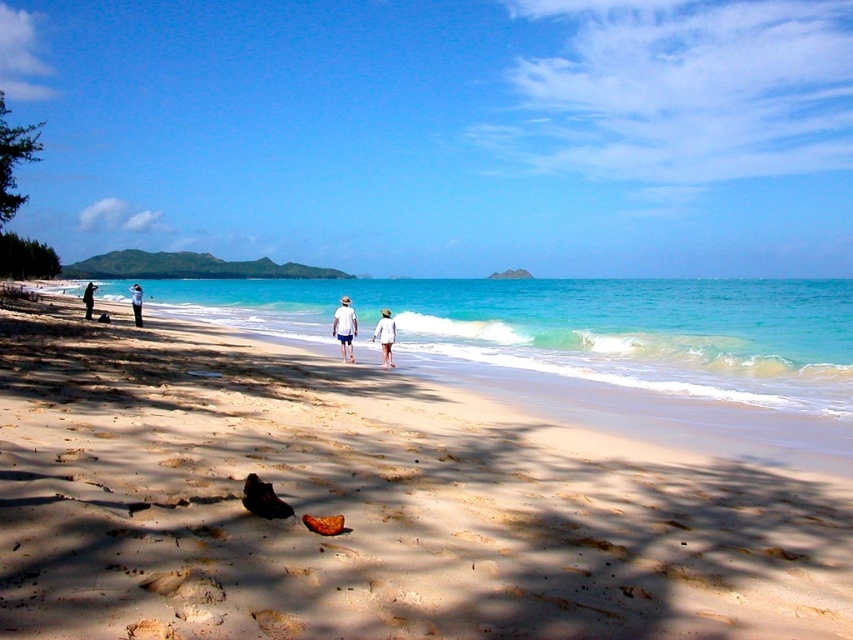
Question: Which object appears closest to the camera in this image?

Choices:
 (A) white cotton hat at center
 (B) dark blue jeans at left
 (C) sandy beach at lower center

Answer: (C)

Question: Based on their relative distances, which object is farther from the sandy beach at lower center?

Choices:
 (A) white cotton hat at center
 (B) clear blue water at center
 (C) white matte clothing at center

Answer: (B)

Question: Can you confirm if white matte clothing at center is thinner than white cotton hat at center?

Choices:
 (A) yes
 (B) no

Answer: (B)

Question: Among these objects, which one is nearest to the camera?

Choices:
 (A) white cotton shirt at center
 (B) dark blue jeans at left
 (C) white cotton hat at center

Answer: (C)

Question: From the image, what is the correct spatial relationship of clear blue water at center in relation to white matte clothing at center?

Choices:
 (A) below
 (B) above

Answer: (B)

Question: Can you confirm if white matte clothing at center is thinner than white cotton hat at center?

Choices:
 (A) yes
 (B) no

Answer: (B)